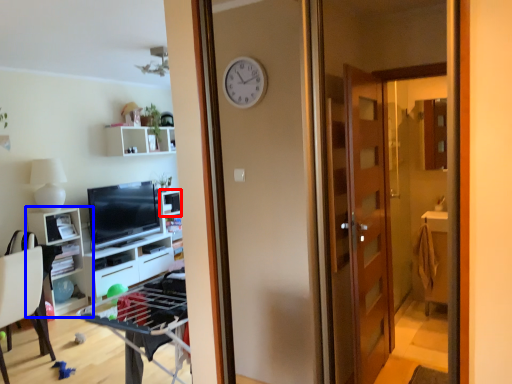
Question: Among these objects, which one is nearest to the camera, shelf (highlighted by a red box) or cabinetry (highlighted by a blue box)?

Choices:
 (A) shelf
 (B) cabinetry

Answer: (B)